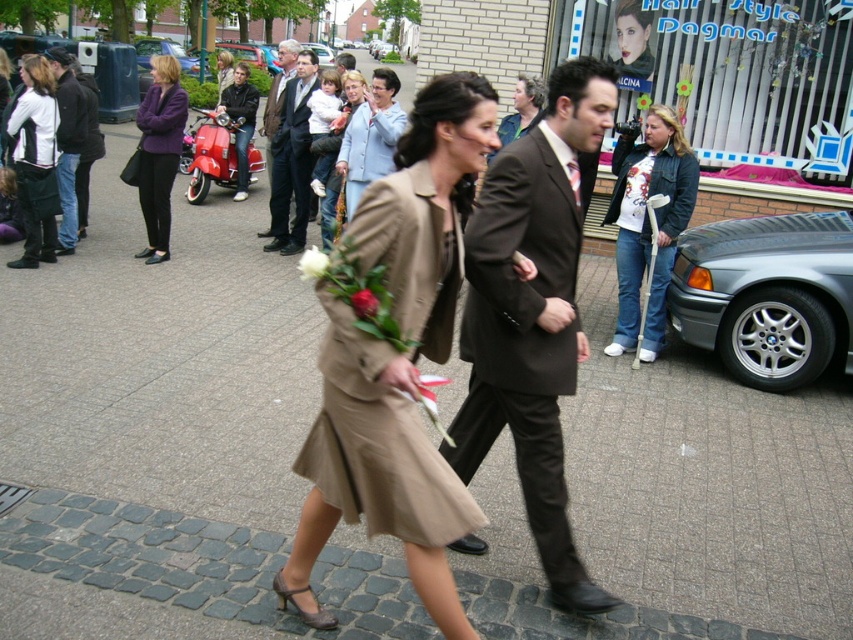
Question: Observing the image, what is the correct spatial positioning of white printed t-shirt at center in reference to light blue fabric jacket at center?

Choices:
 (A) above
 (B) below

Answer: (B)

Question: Does white printed t-shirt at center appear under white matte rose at center?

Choices:
 (A) no
 (B) yes

Answer: (A)

Question: Can you confirm if white printed t-shirt at center is positioned to the right of white leather jacket at left?

Choices:
 (A) yes
 (B) no

Answer: (A)

Question: Which point is farther from the camera taking this photo?

Choices:
 (A) (537, 499)
 (B) (403, 474)
 (C) (238, 177)

Answer: (C)

Question: Which object appears farthest from the camera in this image?

Choices:
 (A) white matte rose at center
 (B) matte brown suit at center

Answer: (B)

Question: Which object is closer to the camera taking this photo?

Choices:
 (A) beige fabric dress at center
 (B) dark brown suit at center
 (C) matte brown suit at center
 (D) purple woolen jacket at upper left

Answer: (A)